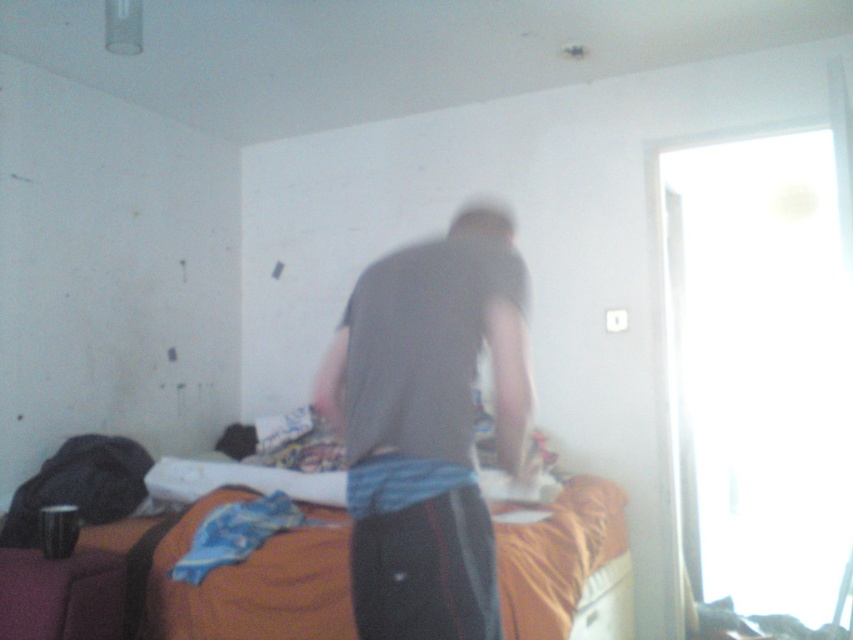
You are trying to decide whether to place a new item on the dark gray shirt at center or the orange fabric bed at center. Based on their heights, which one can accommodate a taller object without it falling over?

The dark gray shirt at center is taller than the orange fabric bed at center, so placing a taller object on the dark gray shirt at center would be more stable and less likely to fall over.

You are organizing a closet and need to place the dark gray shirt at center and the orange fabric bed at center in specific locations. According to the image, which object is positioned to the right of the other?

The dark gray shirt at center is to the right of the orange fabric bed at center.